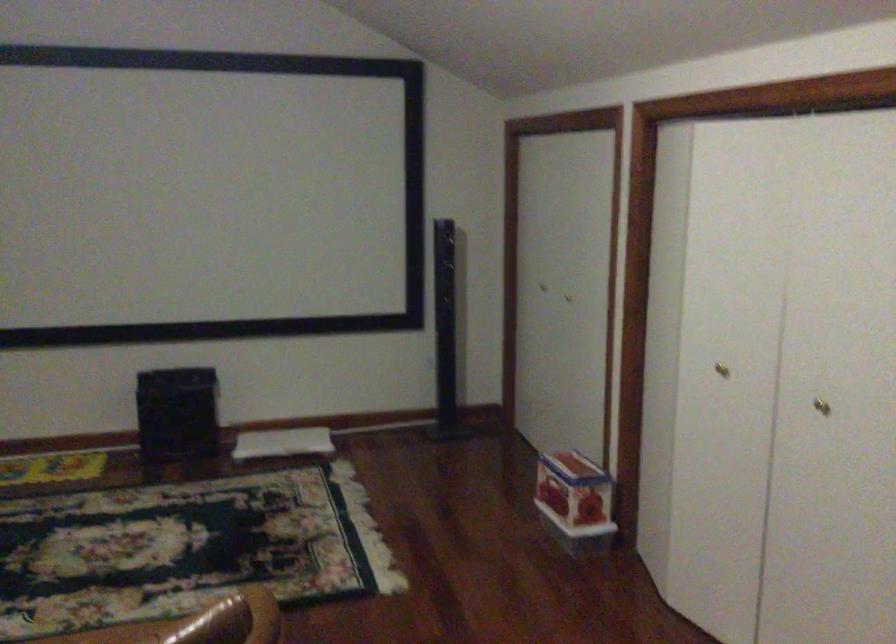
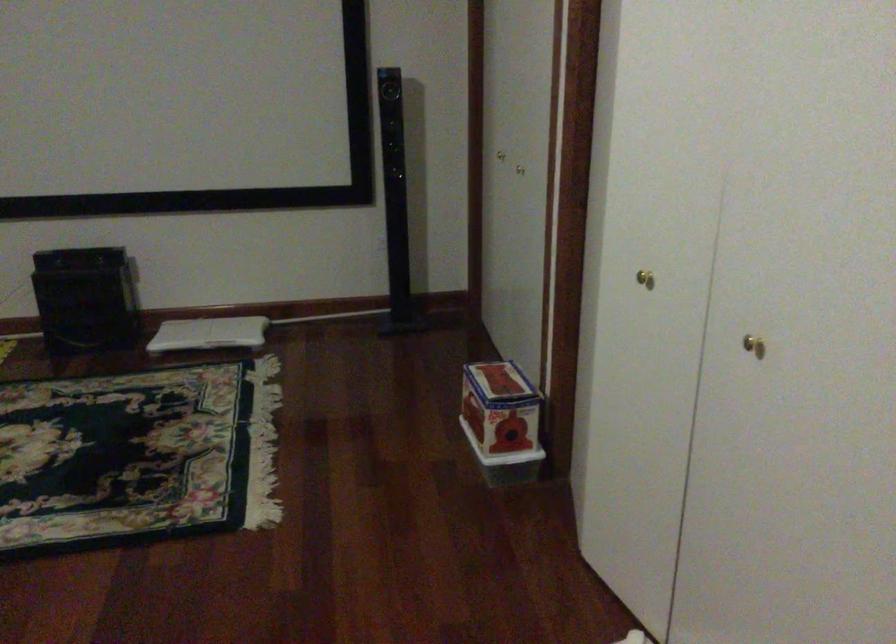
Locate, in the second image, the point that corresponds to point (719, 368) in the first image.

(644, 279)